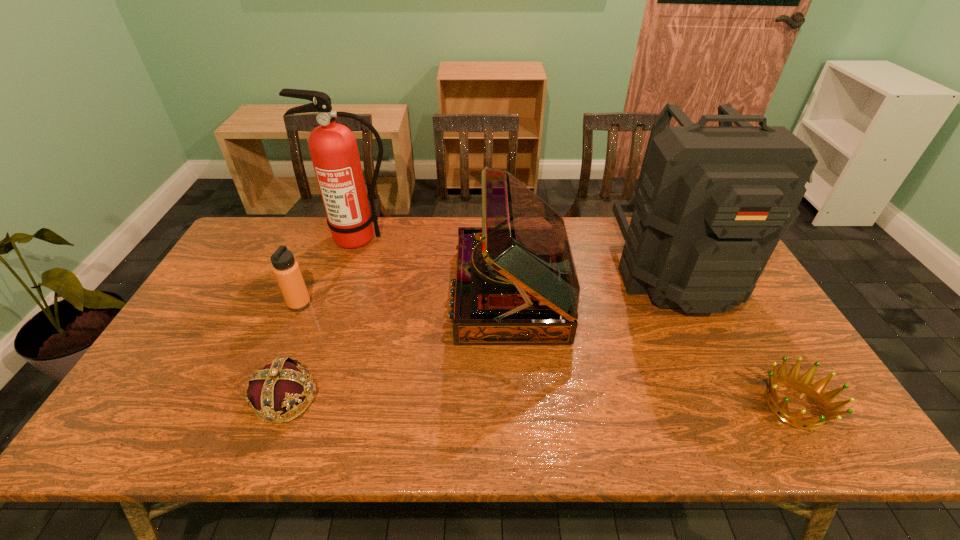
Where is `free space located on the front compartment of the backpack`? This screenshot has height=540, width=960. free space located on the front compartment of the backpack is located at coordinates (715, 349).

Locate an element on the screen. vacant space situated 0.110m on the front-facing side of the fourth object from left to right is located at coordinates (415, 293).

Where is `free space located 0.080m on the front-facing side of the fourth object from left to right`? The image size is (960, 540). free space located 0.080m on the front-facing side of the fourth object from left to right is located at coordinates (425, 293).

Find the location of `free point located on the front-facing side of the fourth object from left to right`. free point located on the front-facing side of the fourth object from left to right is located at coordinates (405, 293).

You are a GUI agent. You are given a task and a screenshot of the screen. Output one action in this format:
    pyautogui.click(x=<x>, y=<y>)
    Task: Click on the vacant region located 0.170m on the front of the third shortest object
    
    Given the screenshot: What is the action you would take?
    pyautogui.click(x=276, y=360)

At what (x,y) coordinates should I click in order to perform the action: click on vacant space located 0.110m on the right of the second shortest object. Please return your answer as a coordinate pair (x, y). Looking at the image, I should click on (364, 399).

Where is `vacant space located 0.050m on the back of the shortest object`? This screenshot has height=540, width=960. vacant space located 0.050m on the back of the shortest object is located at coordinates (767, 360).

Locate an element on the screen. This screenshot has height=540, width=960. fire extinguisher present at the far edge is located at coordinates (333, 148).

Image resolution: width=960 pixels, height=540 pixels. I want to click on backpack at the far edge, so click(x=712, y=202).

Where is `record player positioned at the far edge`? record player positioned at the far edge is located at coordinates (516, 283).